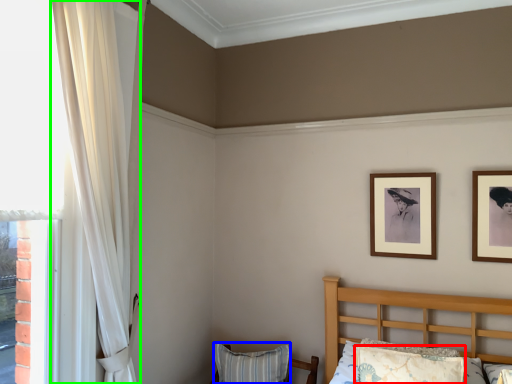
Question: Considering the real-world distances, which object is closest to pillow (highlighted by a red box)? pillow (highlighted by a blue box) or curtain (highlighted by a green box).

Choices:
 (A) pillow
 (B) curtain

Answer: (A)